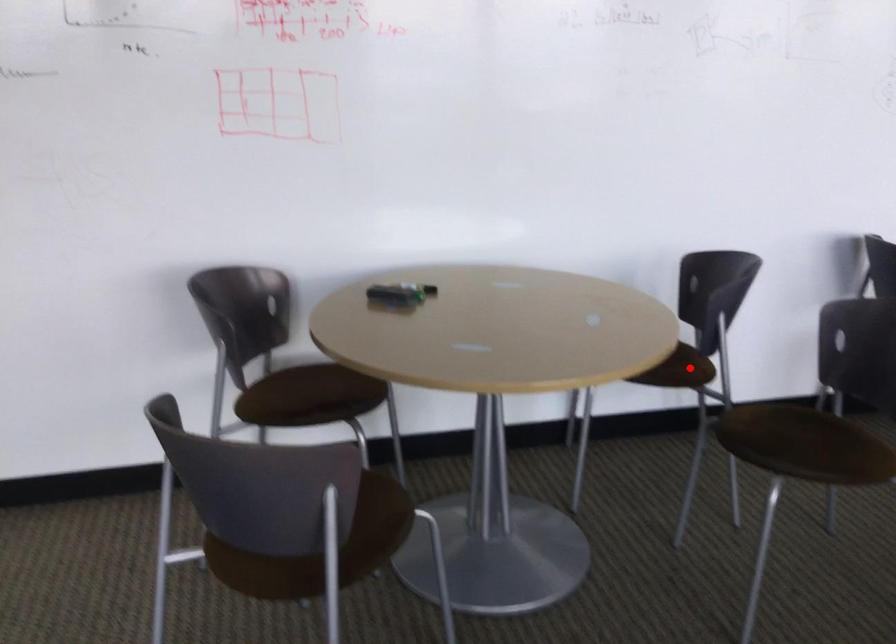
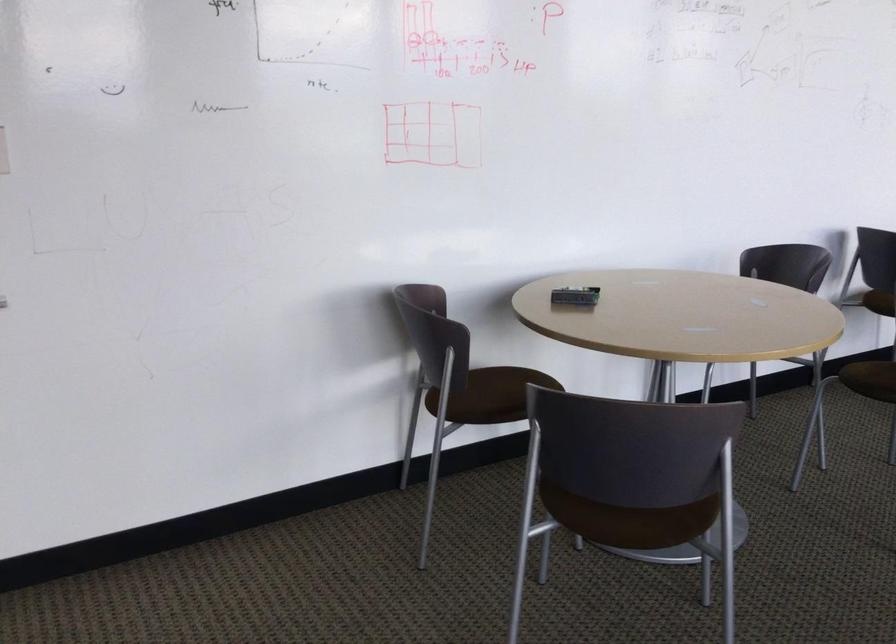
Question: I am providing you with two images of the same scene from different viewpoints. A red point is marked on the first image. Can you still see the location of the red point in image 2?

Choices:
 (A) Yes
 (B) No

Answer: (B)